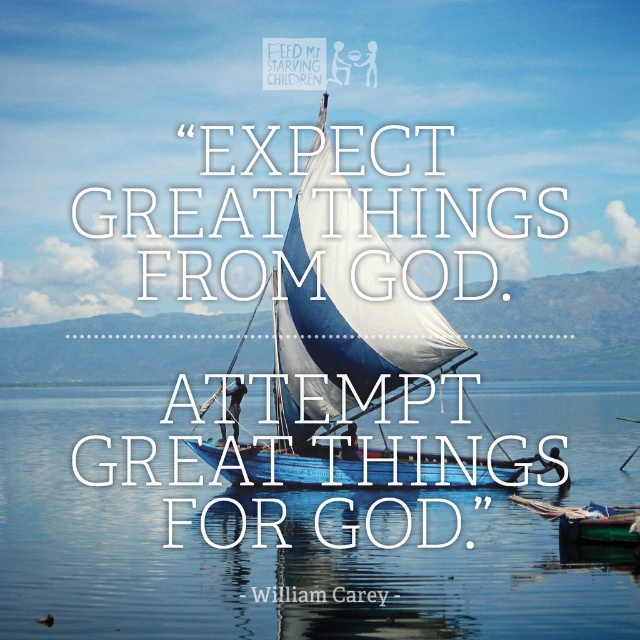
Between transparent blue water at center and blue fabric sailboat at center, which one is positioned higher?

blue fabric sailboat at center is above.

Is point (180, 468) farther from camera compared to point (296, 372)?

That is True.

The height and width of the screenshot is (640, 640). I want to click on transparent blue water at center, so click(x=264, y=547).